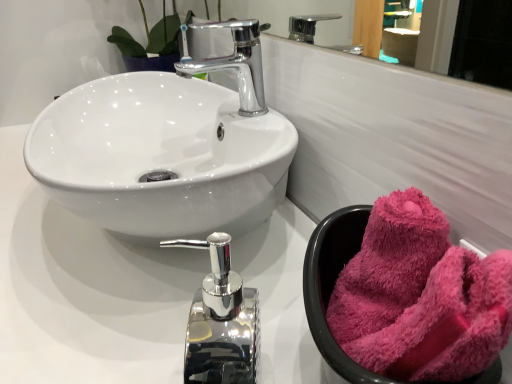
Question: Can you confirm if fuzzy pink towel at right is thinner than glossy chrome mirror at upper center?

Choices:
 (A) yes
 (B) no

Answer: (B)

Question: Is fuzzy pink towel at right shorter than glossy chrome mirror at upper center?

Choices:
 (A) yes
 (B) no

Answer: (B)

Question: Considering the relative positions of fuzzy pink towel at right and glossy chrome mirror at upper center in the image provided, is fuzzy pink towel at right to the left of glossy chrome mirror at upper center from the viewer's perspective?

Choices:
 (A) no
 (B) yes

Answer: (A)

Question: From a real-world perspective, is fuzzy pink towel at right located higher than glossy chrome mirror at upper center?

Choices:
 (A) yes
 (B) no

Answer: (B)

Question: Is fuzzy pink towel at right closer to the viewer compared to glossy chrome mirror at upper center?

Choices:
 (A) no
 (B) yes

Answer: (B)

Question: In terms of width, does polished chrome tap at center, which ranks as the 2th tap in top-to-bottom order, look wider or thinner when compared to glossy chrome mirror at upper center?

Choices:
 (A) thin
 (B) wide

Answer: (B)

Question: Considering the positions of point (212, 374) and point (248, 6), is point (212, 374) closer or farther from the camera than point (248, 6)?

Choices:
 (A) farther
 (B) closer

Answer: (B)

Question: Looking at the image, does polished chrome tap at center, positioned as the 1th tap in bottom-to-top order, seem bigger or smaller compared to glossy chrome mirror at upper center?

Choices:
 (A) big
 (B) small

Answer: (A)

Question: Based on their positions, is polished chrome tap at center, positioned as the 1th tap in bottom-to-top order, located to the left or right of glossy chrome mirror at upper center?

Choices:
 (A) left
 (B) right

Answer: (A)

Question: From a real-world perspective, is fuzzy pink towel at right positioned above or below polished chrome tap at center, which ranks as the 2th tap in back-to-front order?

Choices:
 (A) above
 (B) below

Answer: (A)

Question: Considering the positions of fuzzy pink towel at right and polished chrome tap at center, which ranks as the 2th tap in back-to-front order, in the image, is fuzzy pink towel at right bigger or smaller than polished chrome tap at center, which ranks as the 2th tap in back-to-front order,?

Choices:
 (A) small
 (B) big

Answer: (A)

Question: From the image's perspective, is fuzzy pink towel at right located above or below polished chrome tap at center, which ranks as the 1th tap in front-to-back order?

Choices:
 (A) above
 (B) below

Answer: (A)

Question: Based on their positions, is fuzzy pink towel at right located to the left or right of polished chrome tap at center, positioned as the 1th tap in bottom-to-top order?

Choices:
 (A) right
 (B) left

Answer: (A)

Question: From the image's perspective, is polished chrome tap at center, which ranks as the 2th tap in back-to-front order, located above or below fuzzy pink towel at right?

Choices:
 (A) above
 (B) below

Answer: (B)

Question: Visually, is polished chrome tap at center, which ranks as the 1th tap in front-to-back order, positioned to the left or to the right of fuzzy pink towel at right?

Choices:
 (A) left
 (B) right

Answer: (A)